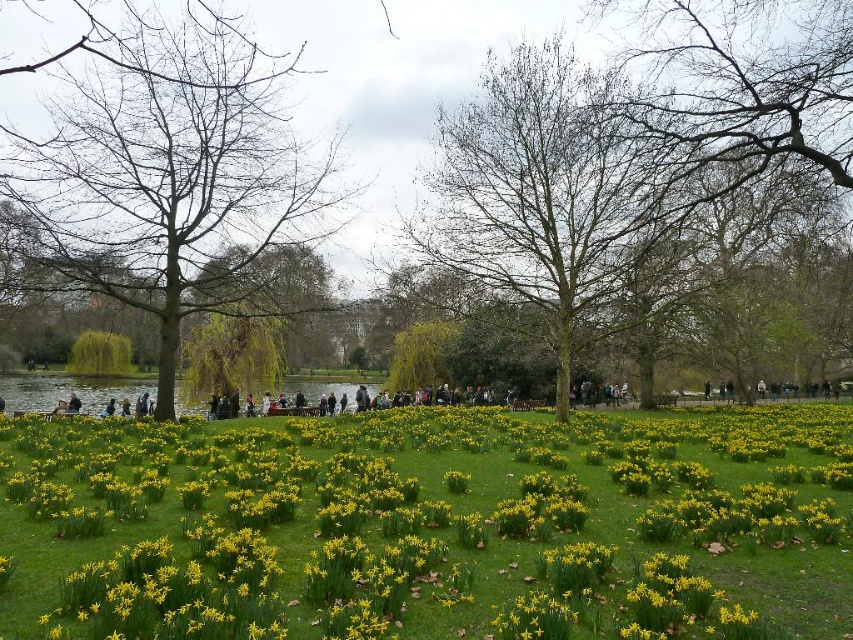
Question: Which point is closer to the camera?

Choices:
 (A) yellow grass at center
 (B) bare wood tree at left

Answer: (A)

Question: Is bare branches at center closer to the viewer compared to bare wood tree at left?

Choices:
 (A) no
 (B) yes

Answer: (A)

Question: Among these objects, which one is farthest from the camera?

Choices:
 (A) bare branches at center
 (B) bare wood tree at left

Answer: (A)

Question: Which of the following is the closest to the observer?

Choices:
 (A) (165, 88)
 (B) (106, 632)

Answer: (B)

Question: Does yellow grass at center have a larger size compared to bare wood tree at left?

Choices:
 (A) no
 (B) yes

Answer: (A)

Question: Is bare branches at center positioned behind bare wood tree at left?

Choices:
 (A) yes
 (B) no

Answer: (A)